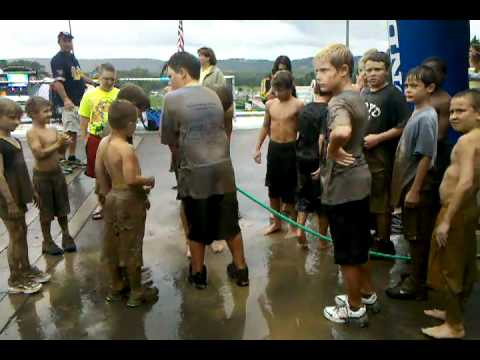
Identify the location of floor. (282, 281).